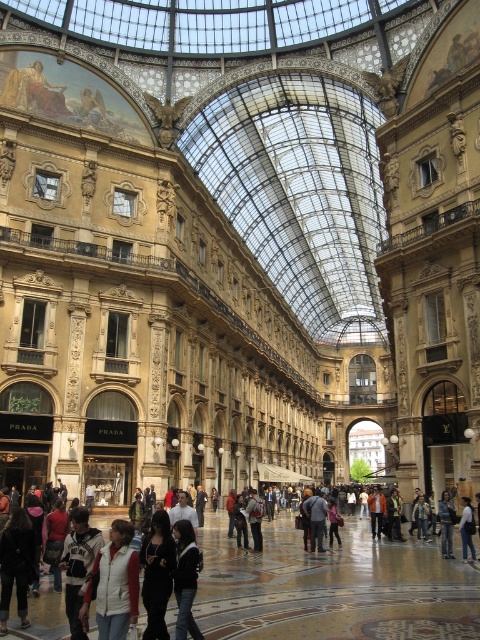
Question: Which is farther from the white cotton hoodie at center?

Choices:
 (A) dark gray fabric jacket at center
 (B) dark gray sweater at center
 (C) white cotton shirt at center

Answer: (C)

Question: Which of the following is the closest to the observer?

Choices:
 (A) dark gray fabric jacket at center
 (B) black fabric jacket at center

Answer: (B)

Question: Does black fabric jacket at center appear under dark gray sweater at center?

Choices:
 (A) no
 (B) yes

Answer: (A)

Question: Can you confirm if dark gray sweater at center is positioned below dark gray fabric jacket at center?

Choices:
 (A) no
 (B) yes

Answer: (A)

Question: Which of these objects is positioned farthest from the black fabric jacket at center?

Choices:
 (A) dark gray sweater at center
 (B) dark gray fabric jacket at center

Answer: (B)

Question: From the image, what is the correct spatial relationship of dark gray fabric jacket at center in relation to white cotton shirt at center?

Choices:
 (A) left
 (B) right

Answer: (A)